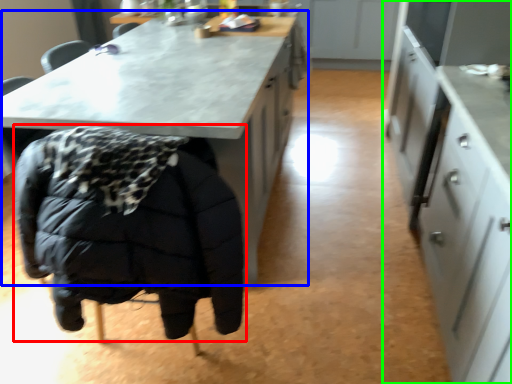
Question: Considering the real-world distances, which object is closest to jacket (highlighted by a red box)? table (highlighted by a blue box) or cabinetry (highlighted by a green box).

Choices:
 (A) table
 (B) cabinetry

Answer: (A)